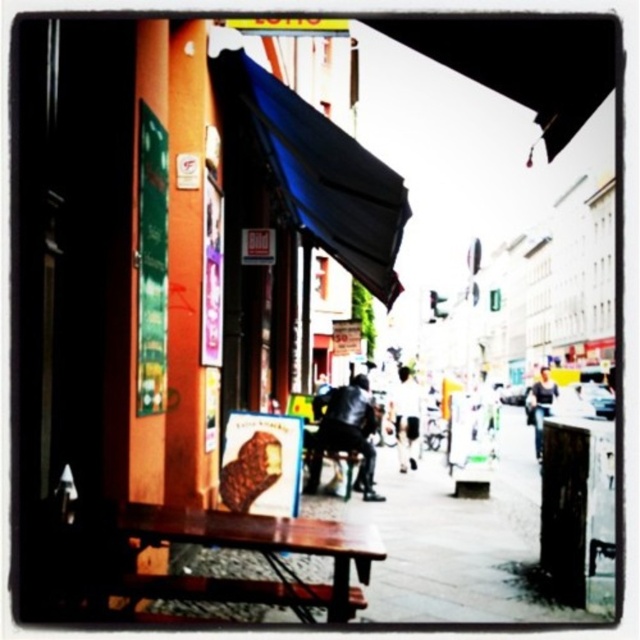
You are a delivery person trying to find shelter from the rain. You see a blue fabric umbrella at upper center and a wooden bench at lower center. Which object can provide better coverage from the rain?

The blue fabric umbrella at upper center might be wider than wooden bench at lower center, so it can provide better coverage from the rain.

You are a photographer standing in the middle of the street. You notice two points marked in the scene. Which point, point (307, 536) or point (408, 442), is closer to your camera lens?

Point (307, 536) is closer to the camera than point (408, 442).

You are a pedestrian standing at the wooden bench at lower center and want to reach the blue fabric umbrella at upper center. Which direction should you walk to get there?

The blue fabric umbrella at upper center is to the right of the wooden bench at lower center, so you should walk to the right to reach it.